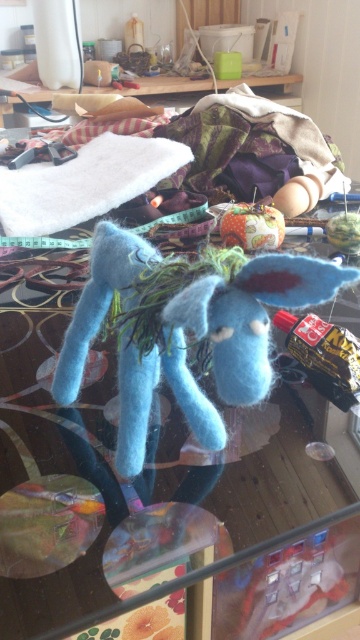
Is fuzzy blue stuffed animal at center in front of wooden table at upper center?

Yes, fuzzy blue stuffed animal at center is closer to the viewer.

In the scene shown: Can you confirm if fuzzy blue stuffed animal at center is thinner than wooden table at upper center?

Yes, fuzzy blue stuffed animal at center is thinner than wooden table at upper center.

Is point (258, 314) positioned before point (7, 112)?

That is True.

Identify the location of fuzzy blue stuffed animal at center. This screenshot has height=640, width=360. (218, 346).

Is white fluffy cloth at upper left bigger than wooden table at upper center?

No.

Who is positioned more to the right, white fluffy cloth at upper left or wooden table at upper center?

Positioned to the right is wooden table at upper center.

Find the location of `white fluffy cloth at upper left`. white fluffy cloth at upper left is located at coordinates (84, 182).

Does fuzzy blue stuffed animal at center have a greater width compared to white fluffy cloth at upper left?

No, fuzzy blue stuffed animal at center is not wider than white fluffy cloth at upper left.

Who is higher up, fuzzy blue stuffed animal at center or white fluffy cloth at upper left?

Positioned higher is white fluffy cloth at upper left.

You are a GUI agent. You are given a task and a screenshot of the screen. Output one action in this format:
    pyautogui.click(x=<x>, y=<y>)
    Task: Click on the fuzzy blue stuffed animal at center
    This screenshot has height=640, width=360.
    Given the screenshot: What is the action you would take?
    pyautogui.click(x=218, y=346)

You are a GUI agent. You are given a task and a screenshot of the screen. Output one action in this format:
    pyautogui.click(x=<x>, y=<y>)
    Task: Click on the fuzzy blue stuffed animal at center
    The image size is (360, 640).
    Given the screenshot: What is the action you would take?
    pyautogui.click(x=218, y=346)